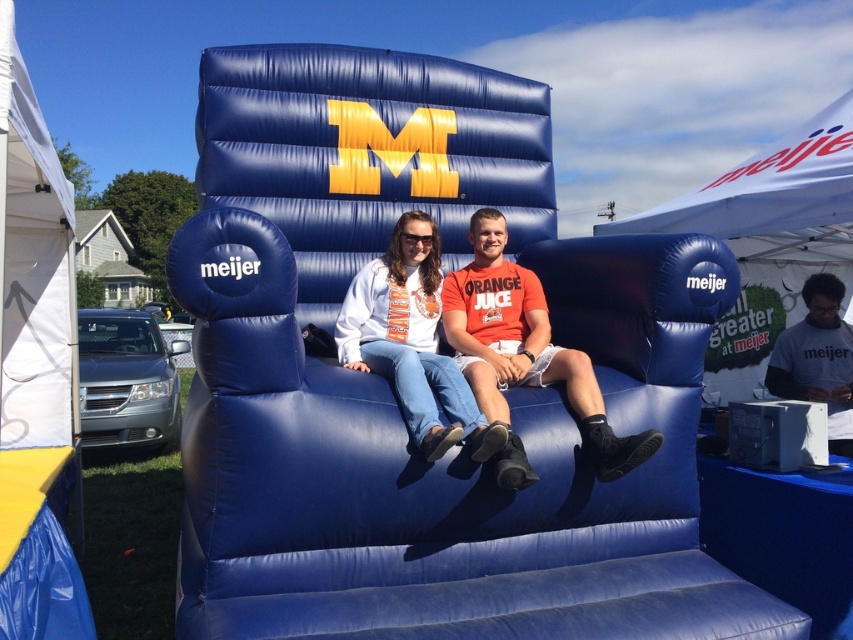
Does matte white shirt at center have a larger size compared to white matte shirt at lower right?

Correct, matte white shirt at center is larger in size than white matte shirt at lower right.

Identify the location of matte white shirt at center. (412, 340).

Where is `matte white shirt at center`? matte white shirt at center is located at coordinates (412, 340).

Who is taller, orange matte shirt at center or matte white shirt at center?

orange matte shirt at center is taller.

Is point (517, 342) positioned in front of point (334, 339)?

No, (517, 342) is behind (334, 339).

At what (x,y) coordinates should I click in order to perform the action: click on orange matte shirt at center. Please return your answer as a coordinate pair (x, y). The height and width of the screenshot is (640, 853). Looking at the image, I should click on (524, 346).

Can you confirm if orange matte shirt at center is positioned above white matte shirt at lower right?

Correct, orange matte shirt at center is located above white matte shirt at lower right.

Is the position of orange matte shirt at center less distant than that of white matte shirt at lower right?

That is True.

Where is `orange matte shirt at center`? orange matte shirt at center is located at coordinates (524, 346).